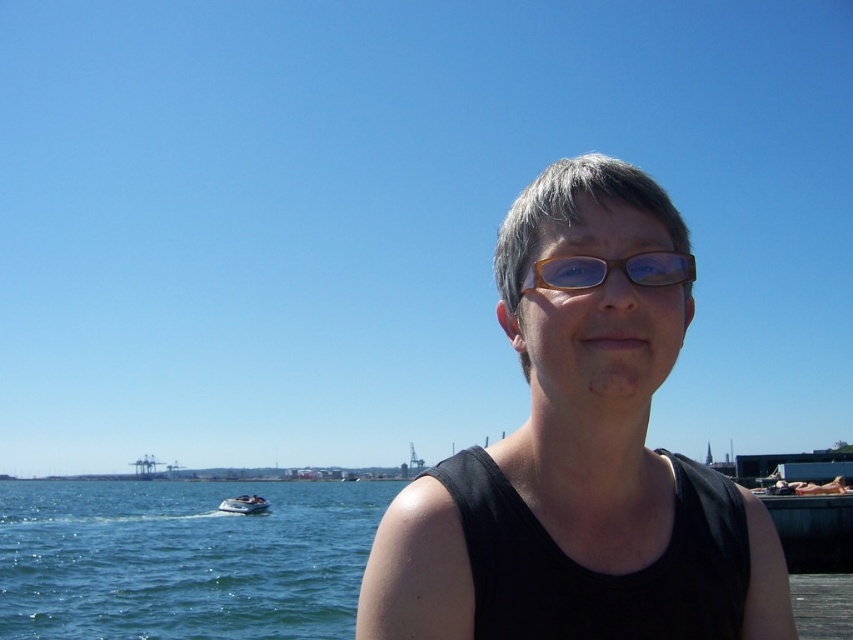
Is black matte tank top at center to the left of blue water at lower left from the viewer's perspective?

In fact, black matte tank top at center is to the right of blue water at lower left.

Can you confirm if black matte tank top at center is wider than blue water at lower left?

Incorrect, black matte tank top at center's width does not surpass blue water at lower left's.

Describe the element at coordinates (579, 461) in the screenshot. I see `black matte tank top at center` at that location.

Where is `black matte tank top at center`? The width and height of the screenshot is (853, 640). black matte tank top at center is located at coordinates (579, 461).

Which is behind, point (550, 260) or point (248, 506)?

Positioned behind is point (248, 506).

Which is in front, point (579, 268) or point (242, 506)?

Point (579, 268) is in front.

What do you see at coordinates (608, 269) in the screenshot? Image resolution: width=853 pixels, height=640 pixels. I see `brown wooden glasses at center` at bounding box center [608, 269].

The image size is (853, 640). Identify the location of brown wooden glasses at center. (608, 269).

Is blue water at lower left thinner than white glossy boat at lower left?

Incorrect, blue water at lower left's width is not less than white glossy boat at lower left's.

Which is behind, point (157, 486) or point (252, 502)?

The point (157, 486) is behind.

Where is `blue water at lower left`? blue water at lower left is located at coordinates (183, 560).